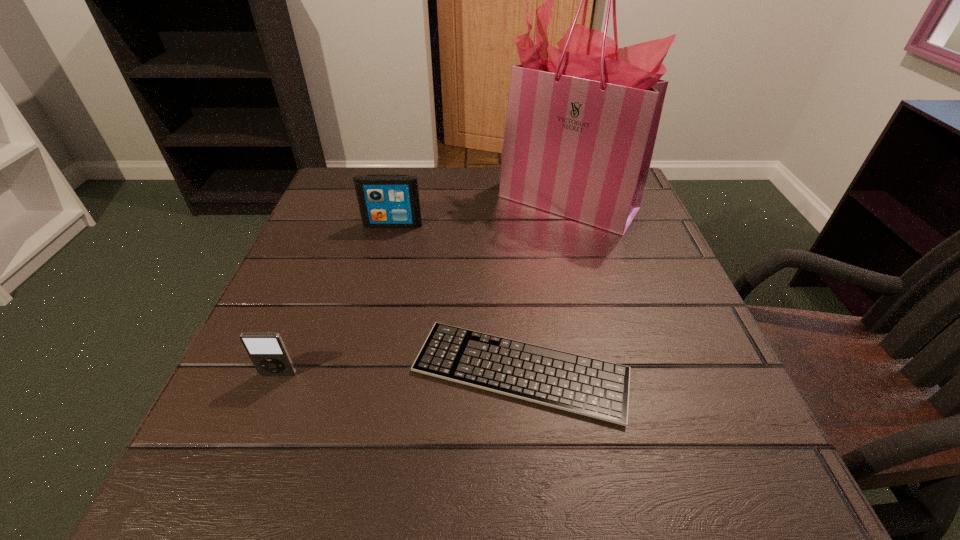
The height and width of the screenshot is (540, 960). In order to click on the tallest object in this screenshot , I will do `click(582, 120)`.

You are a GUI agent. You are given a task and a screenshot of the screen. Output one action in this format:
    pyautogui.click(x=<x>, y=<y>)
    Task: Click on the farther iPod
    
    Given the screenshot: What is the action you would take?
    pyautogui.click(x=385, y=201)

Locate an element on the screen. the taller iPod is located at coordinates (385, 201).

Find the location of a particular element. The width and height of the screenshot is (960, 540). the left iPod is located at coordinates (267, 351).

Find the location of a particular element. The image size is (960, 540). the nearer iPod is located at coordinates (267, 351).

Locate an element on the screen. The height and width of the screenshot is (540, 960). computer keyboard is located at coordinates 599,389.

Locate an element on the screen. Image resolution: width=960 pixels, height=540 pixels. free space located 0.380m on the front of the tallest object is located at coordinates (616, 379).

Identify the location of free point located on the front screen of the farther iPod. This screenshot has height=540, width=960. (372, 304).

I want to click on vacant space located on the front-facing side of the left iPod, so click(x=251, y=442).

The image size is (960, 540). I want to click on vacant space positioned 0.130m on the left of the computer keyboard, so click(331, 371).